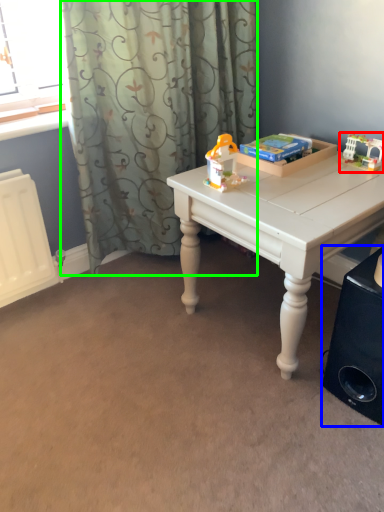
Question: Estimate the real-world distances between objects in this image. Which object is farther from toy (highlighted by a red box), speaker (highlighted by a blue box) or curtain (highlighted by a green box)?

Choices:
 (A) speaker
 (B) curtain

Answer: (B)